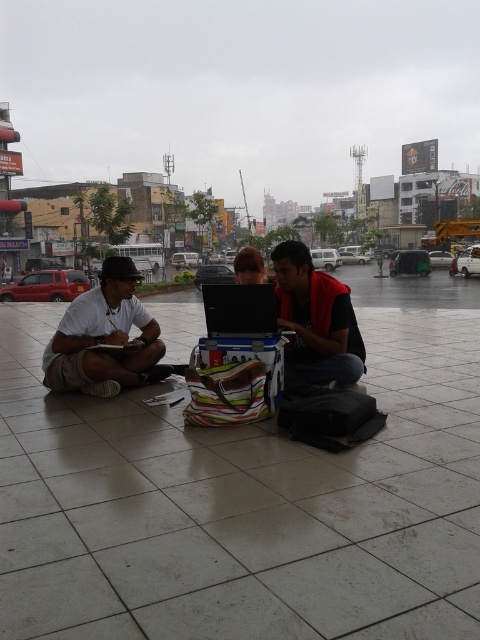
Question: Which point is closer to the camera?

Choices:
 (A) (132, 605)
 (B) (90, 342)
 (C) (316, 296)
 (D) (206, 289)

Answer: (A)

Question: Is red fabric vest at center below black matte laptop at center?

Choices:
 (A) no
 (B) yes

Answer: (A)

Question: Which of the following is the closest to the observer?

Choices:
 (A) (237, 337)
 (B) (393, 480)

Answer: (B)

Question: Can you confirm if white tile pavement at center is smaller than red fabric vest at center?

Choices:
 (A) yes
 (B) no

Answer: (A)

Question: Can you confirm if white tile pavement at center is positioned above matte white shirt at left?

Choices:
 (A) yes
 (B) no

Answer: (B)

Question: Which point is farther from the camera taking this photo?

Choices:
 (A) (290, 269)
 (B) (6, 352)
 (C) (231, 320)
 (D) (126, 365)

Answer: (B)